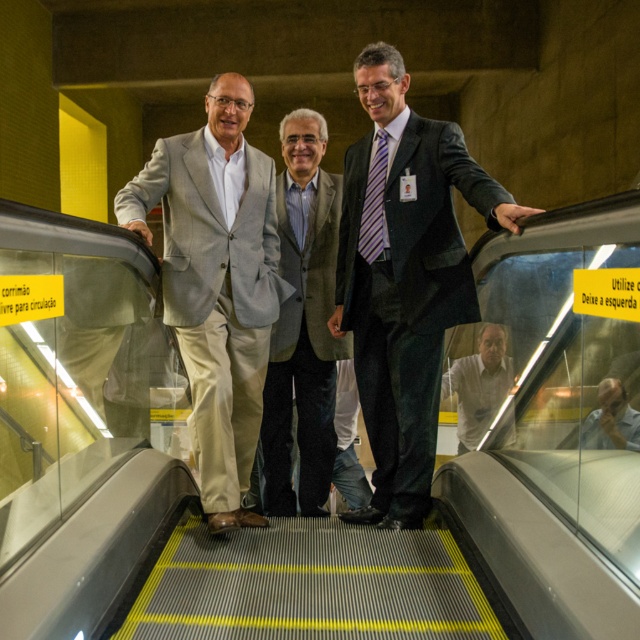
Question: Can you confirm if light gray suit at center is positioned above matte black shirt at center?

Choices:
 (A) yes
 (B) no

Answer: (A)

Question: Which of the following is the closest to the observer?

Choices:
 (A) (237, 97)
 (B) (436, 401)

Answer: (A)

Question: Is light gray suit at center bigger than matte black shirt at center?

Choices:
 (A) no
 (B) yes

Answer: (B)

Question: Which of the following is the closest to the observer?

Choices:
 (A) light gray suit at center
 (B) matte black shirt at center
 (C) white glossy shirt at center
 (D) dark gray suit at center

Answer: (B)

Question: Is dark gray suit at center behind light gray suit at center?

Choices:
 (A) yes
 (B) no

Answer: (B)

Question: Which point appears farthest from the camera in this image?

Choices:
 (A) (326, 403)
 (B) (420, 294)
 (C) (600, 419)

Answer: (A)